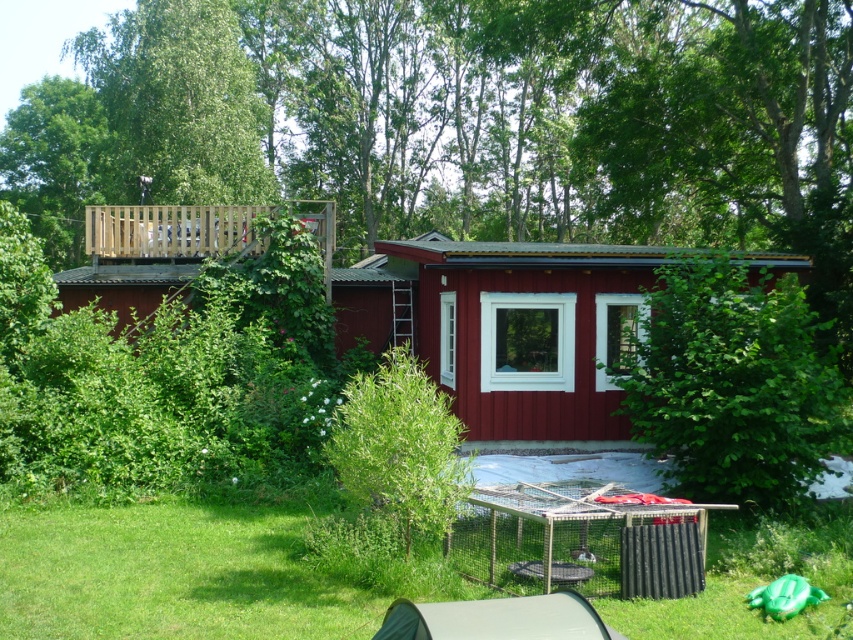
Can you confirm if green grass at lower center is taller than smooth wooden cabin at center?

No.

Where is `green grass at lower center`? The width and height of the screenshot is (853, 640). green grass at lower center is located at coordinates (170, 573).

The height and width of the screenshot is (640, 853). What do you see at coordinates (170, 573) in the screenshot?
I see `green grass at lower center` at bounding box center [170, 573].

In order to click on green grass at lower center in this screenshot , I will do `click(170, 573)`.

Who is positioned more to the right, smooth wooden cabin at center or gray fabric tent at lower center?

Positioned to the right is gray fabric tent at lower center.

Describe the element at coordinates (506, 330) in the screenshot. I see `smooth wooden cabin at center` at that location.

At what (x,y) coordinates should I click in order to perform the action: click on smooth wooden cabin at center. Please return your answer as a coordinate pair (x, y). The width and height of the screenshot is (853, 640). Looking at the image, I should click on (506, 330).

Can you confirm if green grass at lower center is positioned to the right of gray fabric tent at lower center?

No, green grass at lower center is not to the right of gray fabric tent at lower center.

Can you confirm if green grass at lower center is bigger than gray fabric tent at lower center?

No.

Where is `green grass at lower center`? green grass at lower center is located at coordinates (170, 573).